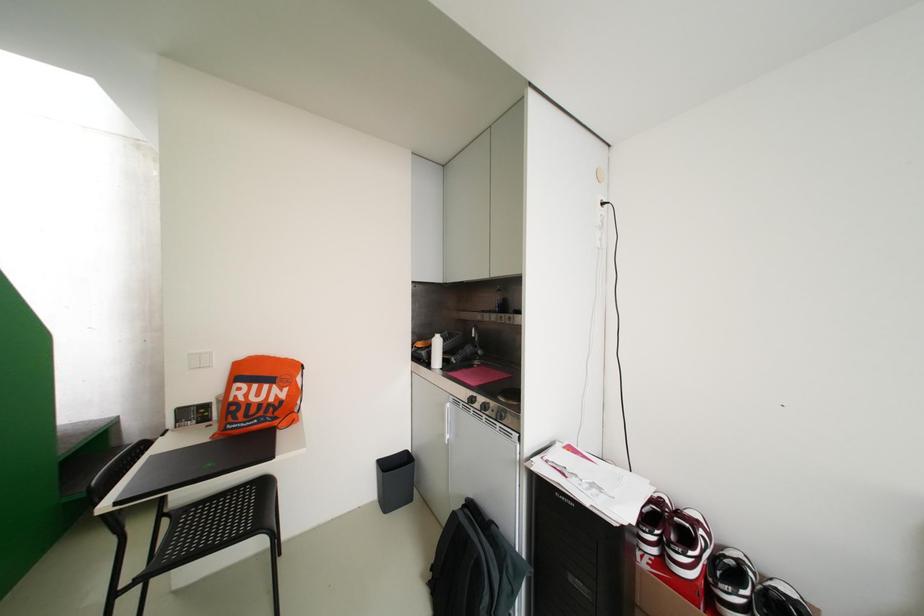
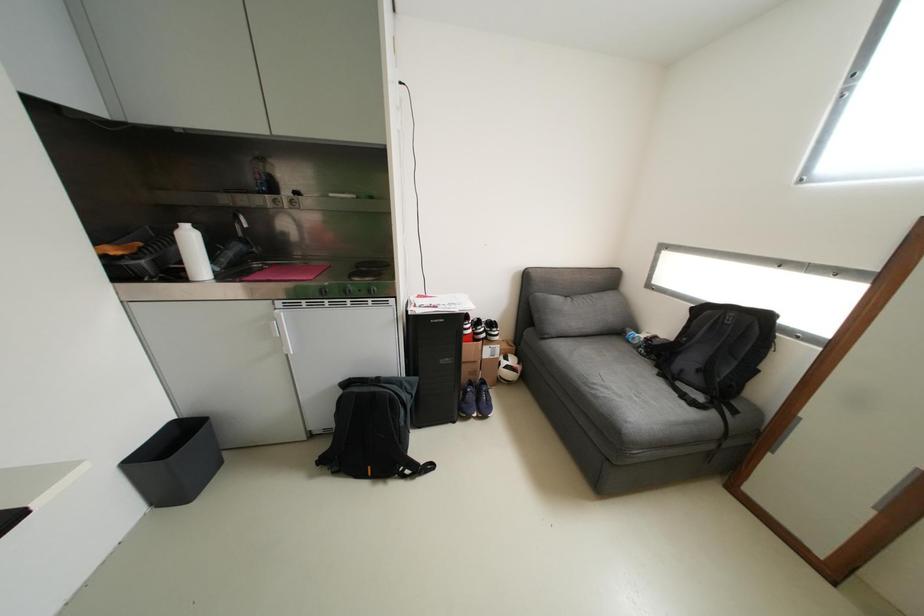
The first image is from the beginning of the video and the second image is from the end. How did the camera likely rotate when shooting the video?

The camera rotated toward right-down.